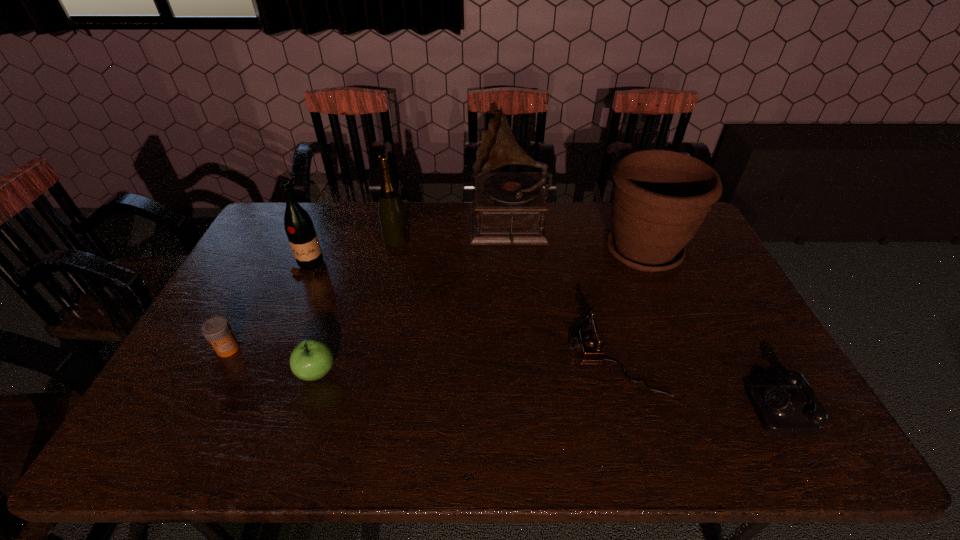
The image size is (960, 540). I want to click on telephone that is at the right edge, so click(782, 409).

I want to click on object that is at the far right corner, so click(x=660, y=198).

Where is `object that is at the near right corner`? The image size is (960, 540). object that is at the near right corner is located at coordinates pos(782,409).

In the image, there is a desktop. What are the coordinates of `blank space at the far edge` in the screenshot? It's located at (467, 239).

The height and width of the screenshot is (540, 960). I want to click on vacant space at the near edge of the desktop, so click(372, 428).

I want to click on vacant space at the left edge of the desktop, so click(x=241, y=293).

This screenshot has width=960, height=540. Identify the location of free space at the right edge of the desktop. (749, 364).

This screenshot has height=540, width=960. What are the coordinates of `vacant space at the near left corner` in the screenshot? It's located at (155, 426).

You are a GUI agent. You are given a task and a screenshot of the screen. Output one action in this format:
    pyautogui.click(x=<x>, y=<y>)
    Task: Click on the vacant space in between the seventh object from right to left and the flowerpot
    
    Given the screenshot: What is the action you would take?
    click(477, 259)

You are a GUI agent. You are given a task and a screenshot of the screen. Output one action in this format:
    pyautogui.click(x=<x>, y=<y>)
    Task: Click on the free space between the fourth object from left to right and the tallest object
    Image resolution: width=960 pixels, height=540 pixels.
    Given the screenshot: What is the action you would take?
    pyautogui.click(x=453, y=233)